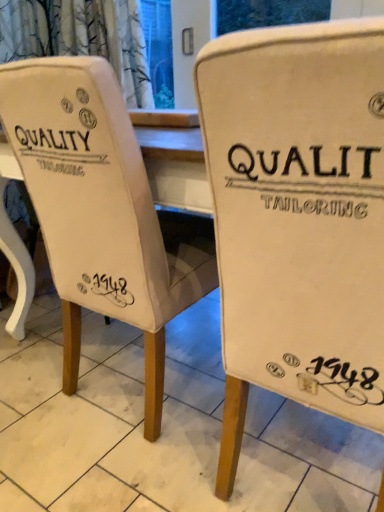
I want to click on white canvas chair at center, so click(162, 428).

This screenshot has width=384, height=512. What do you see at coordinates (97, 209) in the screenshot?
I see `white fabric chair at center, the first chair in the left-to-right sequence` at bounding box center [97, 209].

Measure the distance between point [264,227] and camera.

They are 66.90 centimeters apart.

Identify the location of white canvas chair at center. The image size is (384, 512). (162, 428).

From a real-world perspective, between beige fabric chair at center, which is counted as the second chair, starting from the left, and white fabric chair at center, the first chair in the left-to-right sequence, who is vertically lower?

From a 3D spatial view, white fabric chair at center, the first chair in the left-to-right sequence, is below.

In terms of size, does beige fabric chair at center, which is counted as the second chair, starting from the left, appear bigger or smaller than white fabric chair at center, the first chair in the left-to-right sequence?

beige fabric chair at center, which is counted as the second chair, starting from the left, is smaller than white fabric chair at center, the first chair in the left-to-right sequence.

Which is more to the left, beige fabric chair at center, which is counted as the second chair, starting from the left, or white fabric chair at center, the second chair viewed from the right?

white fabric chair at center, the second chair viewed from the right, is more to the left.

Which object is closer to the camera, beige fabric chair at center, which is counted as the second chair, starting from the left, or white fabric chair at center, the first chair in the left-to-right sequence?

beige fabric chair at center, which is counted as the second chair, starting from the left, is more forward.

Is white fabric chair at center, the first chair in the left-to-right sequence, oriented away from white canvas chair at center?

No.

Which object is further away from the camera, white fabric chair at center, the second chair viewed from the right, or white canvas chair at center?

white fabric chair at center, the second chair viewed from the right, is more distant.

Is point (68, 150) positioned behind point (142, 425)?

No.

Considering the relative sizes of white fabric chair at center, the second chair viewed from the right, and beige fabric chair at center, the first chair from the right, in the image provided, is white fabric chair at center, the second chair viewed from the right, bigger than beige fabric chair at center, the first chair from the right,?

Yes, white fabric chair at center, the second chair viewed from the right, is bigger than beige fabric chair at center, the first chair from the right.

Does white fabric chair at center, the second chair viewed from the right, turn towards beige fabric chair at center, the first chair from the right?

No, white fabric chair at center, the second chair viewed from the right, is not turned towards beige fabric chair at center, the first chair from the right.

Find the location of a particular element. This screenshot has width=384, height=512. chair located on the left of beige fabric chair at center, which is counted as the second chair, starting from the left is located at coordinates (97, 209).

Does point (193, 357) come closer to viewer compared to point (326, 70)?

No, it is not.

From a real-world perspective, relative to beige fabric chair at center, the first chair from the right, is white canvas chair at center vertically above or below?

white canvas chair at center is situated lower than beige fabric chair at center, the first chair from the right, in the real world.

Does white canvas chair at center have a lesser height compared to beige fabric chair at center, the first chair from the right?

Indeed, white canvas chair at center has a lesser height compared to beige fabric chair at center, the first chair from the right.

From the image's perspective, is white canvas chair at center above or below beige fabric chair at center, which is counted as the second chair, starting from the left?

white canvas chair at center is situated lower than beige fabric chair at center, which is counted as the second chair, starting from the left, in the image.

From a real-world perspective, who is located lower, white canvas chair at center or white fabric chair at center, the first chair in the left-to-right sequence?

From a 3D spatial view, white canvas chair at center is below.

Is white canvas chair at center oriented away from white fabric chair at center, the second chair viewed from the right?

No, white canvas chair at center's orientation is not away from white fabric chair at center, the second chair viewed from the right.

Can you confirm if white canvas chair at center is positioned to the left of white fabric chair at center, the first chair in the left-to-right sequence?

Correct, you'll find white canvas chair at center to the left of white fabric chair at center, the first chair in the left-to-right sequence.

Is white canvas chair at center a part of beige fabric chair at center, the first chair from the right?

That's incorrect, white canvas chair at center is not inside beige fabric chair at center, the first chair from the right.

Which point is more forward, (259, 281) or (359, 455)?

The point (259, 281) is closer.

Based on their sizes in the image, would you say beige fabric chair at center, which is counted as the second chair, starting from the left, is bigger or smaller than white canvas chair at center?

Considering their sizes, beige fabric chair at center, which is counted as the second chair, starting from the left, takes up more space than white canvas chair at center.

At what (x,y) coordinates should I click in order to perform the action: click on chair in front of the white canvas chair at center. Please return your answer as a coordinate pair (x, y). Looking at the image, I should click on (298, 218).

Where is `chair below the white fabric chair at center, the first chair in the left-to-right sequence (from the image's perspective)`? chair below the white fabric chair at center, the first chair in the left-to-right sequence (from the image's perspective) is located at coordinates (298, 218).

The image size is (384, 512). What are the coordinates of `the 1st chair located above the white canvas chair at center (from a real-world perspective)` in the screenshot? It's located at (97, 209).

Considering their positions, is beige fabric chair at center, the first chair from the right, positioned closer to white fabric chair at center, the second chair viewed from the right, than white canvas chair at center?

Based on the image, beige fabric chair at center, the first chair from the right, appears to be nearer to white fabric chair at center, the second chair viewed from the right.

Consider the image. From the image, which object appears to be nearer to white canvas chair at center, white fabric chair at center, the first chair in the left-to-right sequence, or beige fabric chair at center, which is counted as the second chair, starting from the left?

white fabric chair at center, the first chair in the left-to-right sequence, is positioned closer to the anchor white canvas chair at center.

Estimate the real-world distances between objects in this image. Which object is closer to white canvas chair at center, beige fabric chair at center, the first chair from the right, or white fabric chair at center, the second chair viewed from the right?

white fabric chair at center, the second chair viewed from the right, is positioned closer to the anchor white canvas chair at center.

From the picture: Which object lies further to the anchor point beige fabric chair at center, the first chair from the right, white canvas chair at center or white fabric chair at center, the first chair in the left-to-right sequence?

white canvas chair at center lies further to beige fabric chair at center, the first chair from the right, than the other object.

Looking at the image, which one is located further to beige fabric chair at center, which is counted as the second chair, starting from the left, white fabric chair at center, the second chair viewed from the right, or white canvas chair at center?

white canvas chair at center is further to beige fabric chair at center, which is counted as the second chair, starting from the left.

Which object lies further to the anchor point white fabric chair at center, the second chair viewed from the right, white canvas chair at center or beige fabric chair at center, which is counted as the second chair, starting from the left?

Based on the image, white canvas chair at center appears to be further to white fabric chair at center, the second chair viewed from the right.

Image resolution: width=384 pixels, height=512 pixels. I want to click on chair located between white canvas chair at center and beige fabric chair at center, which is counted as the second chair, starting from the left, in the left-right direction, so click(x=97, y=209).